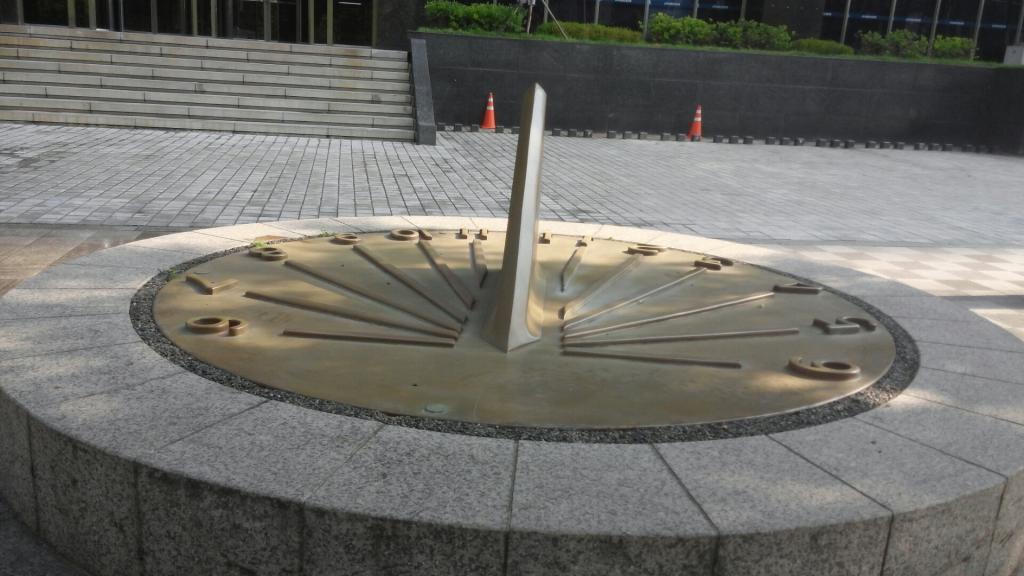
Locate an element on the screen. windows is located at coordinates (870, 14), (914, 18).